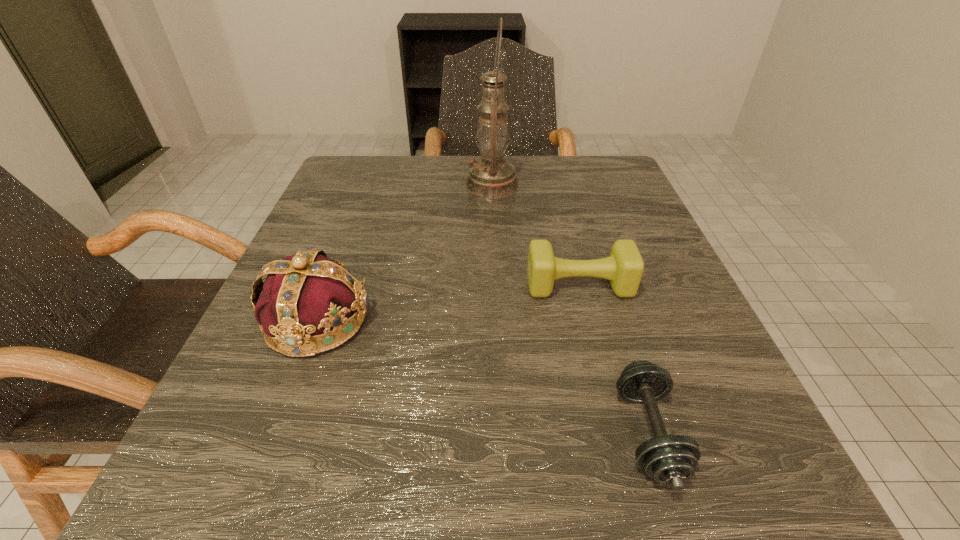
Locate an element on the screen. The height and width of the screenshot is (540, 960). the tallest object is located at coordinates (491, 176).

Locate an element on the screen. The image size is (960, 540). oil lamp is located at coordinates (491, 176).

Find the location of `crown`. crown is located at coordinates (303, 295).

Locate an element on the screen. The image size is (960, 540). the third shortest object is located at coordinates (303, 295).

The width and height of the screenshot is (960, 540). What are the coordinates of `the farther dumbbell` in the screenshot? It's located at (624, 268).

Where is `the nearest object`? The image size is (960, 540). the nearest object is located at coordinates (672, 459).

Where is `vacant area situated 0.280m on the front of the tallest object`? Image resolution: width=960 pixels, height=540 pixels. vacant area situated 0.280m on the front of the tallest object is located at coordinates (496, 287).

Find the location of a particular element. Image resolution: width=960 pixels, height=540 pixels. free location located on the back of the crown is located at coordinates (348, 239).

Image resolution: width=960 pixels, height=540 pixels. I want to click on vacant space located 0.210m on the front of the farther dumbbell, so click(x=612, y=418).

I want to click on free location located on the back of the nearer dumbbell, so click(x=604, y=292).